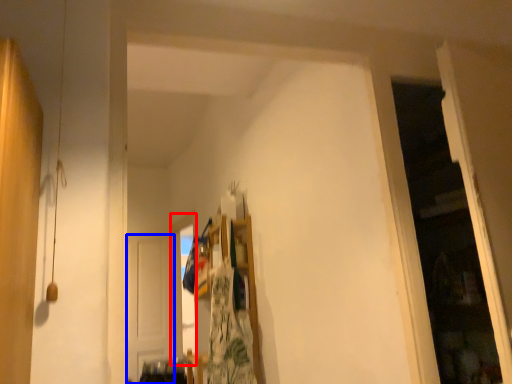
Question: Which object appears closest to the camera in this image, window (highlighted by a red box) or door (highlighted by a blue box)?

Choices:
 (A) window
 (B) door

Answer: (A)